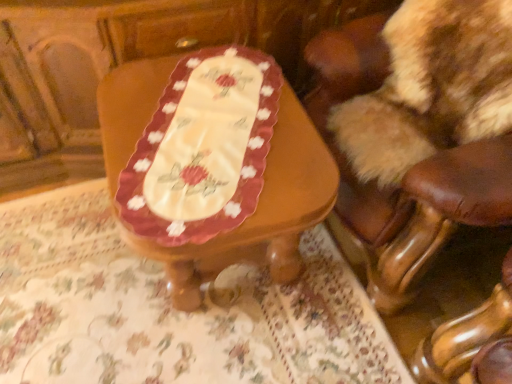
Where is `blank space above beige fabric tablecloth at center (from a real-world perspective)`? The image size is (512, 384). blank space above beige fabric tablecloth at center (from a real-world perspective) is located at coordinates (216, 299).